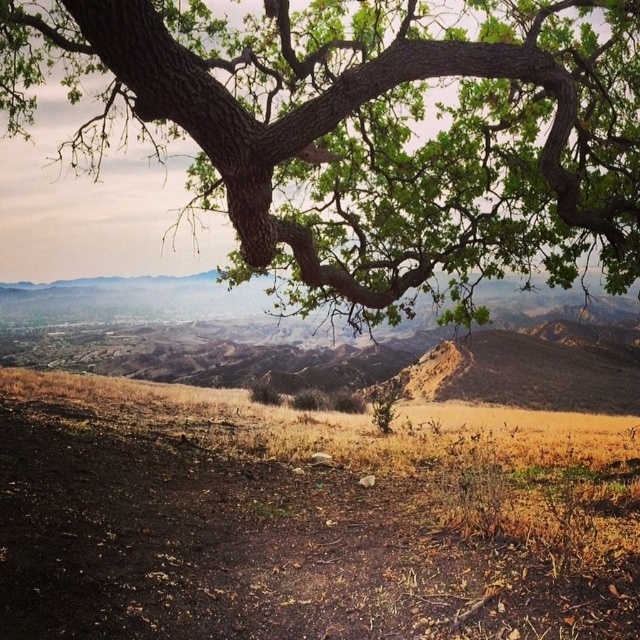
Question: Can you confirm if green rough bark tree at upper center is thinner than brown dry soil at lower center?

Choices:
 (A) no
 (B) yes

Answer: (A)

Question: Which of the following is the closest to the observer?

Choices:
 (A) green rough bark tree at upper center
 (B) brown dry soil at lower center

Answer: (B)

Question: Does green rough bark tree at upper center have a smaller size compared to brown dry soil at lower center?

Choices:
 (A) no
 (B) yes

Answer: (A)

Question: Among these objects, which one is farthest from the camera?

Choices:
 (A) brown dry soil at lower center
 (B) green rough bark tree at upper center

Answer: (B)

Question: Among these points, which one is farthest from the camera?

Choices:
 (A) (468, 257)
 (B) (228, 611)

Answer: (A)

Question: Does green rough bark tree at upper center appear on the left side of brown dry soil at lower center?

Choices:
 (A) no
 (B) yes

Answer: (B)